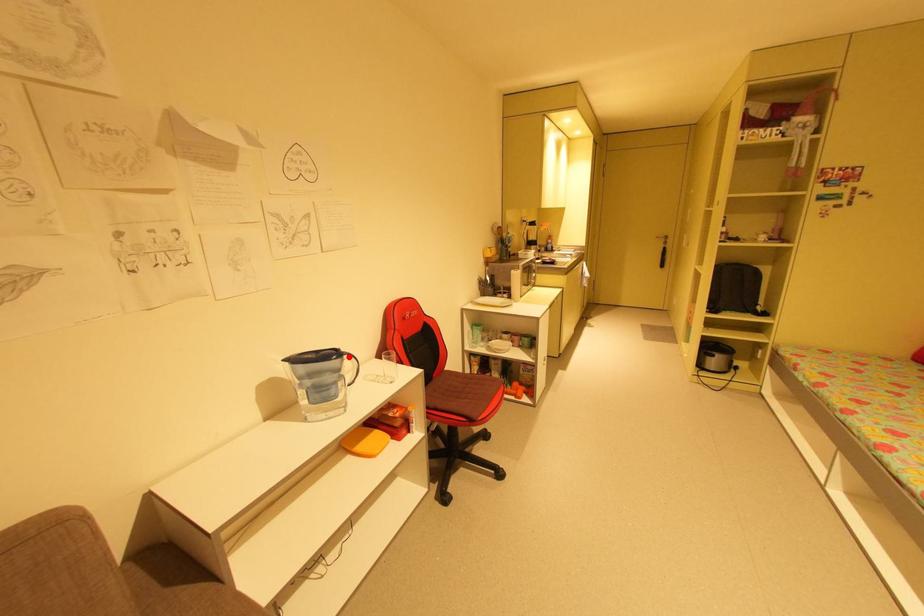
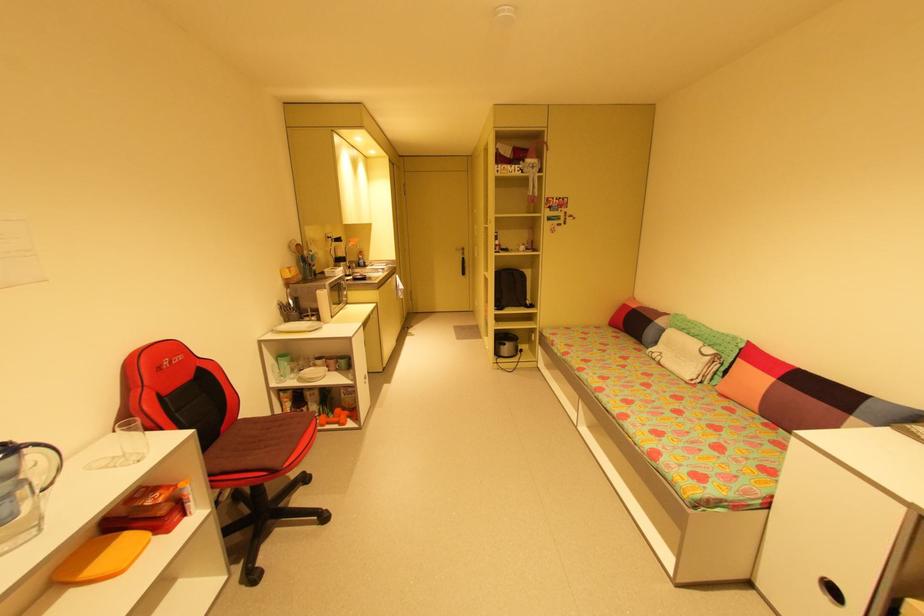
Question: I am providing you with two images of the same scene from different viewpoints. In image1, a red point is highlighted. Considering the same 3D point in image2, which of the following is correct?

Choices:
 (A) It is closer
 (B) It is farther

Answer: (B)